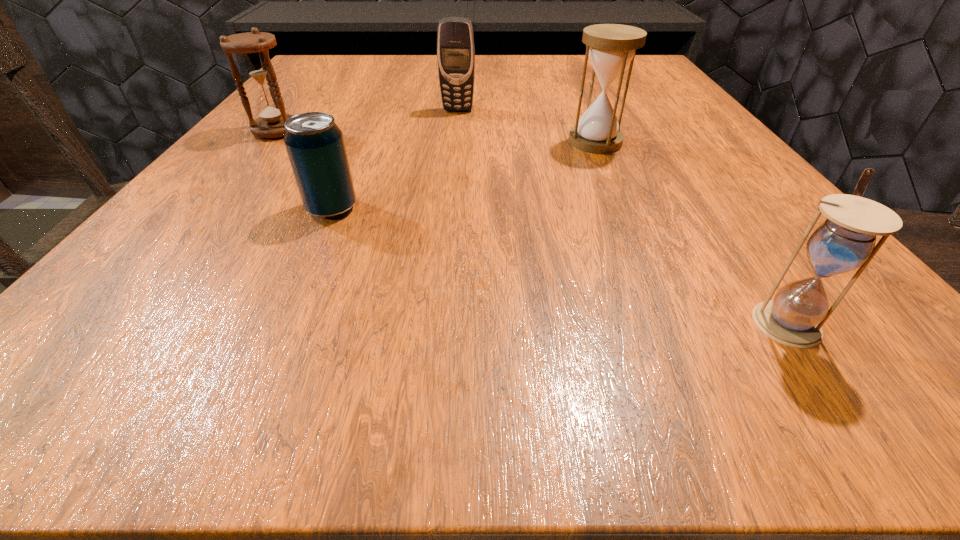
This screenshot has height=540, width=960. Find the location of `vacant space at the right edge of the desktop`. vacant space at the right edge of the desktop is located at coordinates (626, 108).

Where is `vacant space at the far right corner of the desktop`? Image resolution: width=960 pixels, height=540 pixels. vacant space at the far right corner of the desktop is located at coordinates (616, 89).

Locate an element on the screen. The image size is (960, 540). free area in between the third object from right to left and the second object from right to left is located at coordinates (526, 126).

The height and width of the screenshot is (540, 960). I want to click on vacant point located between the leftmost object and the rightmost hourglass, so click(531, 226).

Locate an element on the screen. The height and width of the screenshot is (540, 960). blank region between the second object from right to left and the third object from left to right is located at coordinates (526, 126).

Where is `vacant region between the soda can and the rightmost hourglass`? vacant region between the soda can and the rightmost hourglass is located at coordinates (559, 265).

Find the location of a particular element. free space between the fourth farthest object and the nearest object is located at coordinates (559, 265).

Find the location of a particular element. This screenshot has width=960, height=540. vacant space that's between the rightmost hourglass and the leftmost hourglass is located at coordinates (531, 226).

You are a GUI agent. You are given a task and a screenshot of the screen. Output one action in this format:
    pyautogui.click(x=<x>, y=<y>)
    Task: Click on the vacant region between the leftmost hourglass and the cellular telephone
    
    Given the screenshot: What is the action you would take?
    pyautogui.click(x=367, y=121)

Locate an element on the screen. The image size is (960, 540). empty space between the rightmost hourglass and the second hourglass from left to right is located at coordinates (690, 231).